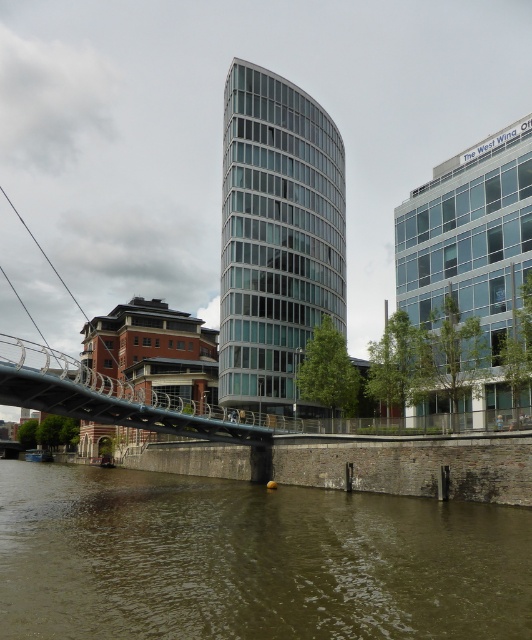
Can you confirm if brown concrete river at lower center is positioned to the left of clear glass building at center?

Indeed, brown concrete river at lower center is positioned on the left side of clear glass building at center.

Is brown concrete river at lower center positioned in front of clear glass building at center?

Yes, it is.

Describe the element at coordinates (251, 561) in the screenshot. I see `brown concrete river at lower center` at that location.

The width and height of the screenshot is (532, 640). What are the coordinates of `brown concrete river at lower center` in the screenshot? It's located at (251, 561).

Between brown concrete river at lower center and metallic gray bridge at center, which one appears on the left side from the viewer's perspective?

metallic gray bridge at center

What do you see at coordinates (251, 561) in the screenshot?
I see `brown concrete river at lower center` at bounding box center [251, 561].

Identify the location of brown concrete river at lower center. (251, 561).

Is clear glass building at center behind metallic gray bridge at center?

That is True.

Does point (318, 410) come closer to viewer compared to point (105, 384)?

No, it is not.

You are a GUI agent. You are given a task and a screenshot of the screen. Output one action in this format:
    pyautogui.click(x=<x>, y=<y>)
    Task: Click on the clear glass building at center
    This screenshot has height=640, width=532.
    Given the screenshot: What is the action you would take?
    pyautogui.click(x=277, y=236)